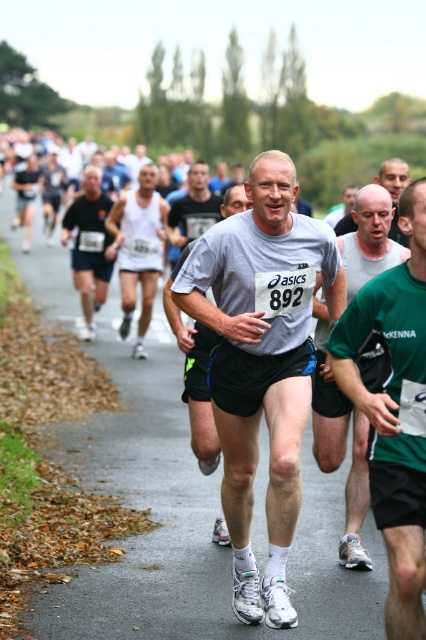
Question: Is white fabric runner at center positioned in front of smooth gray shirt at center?

Choices:
 (A) no
 (B) yes

Answer: (B)

Question: Which object appears farthest from the camera in this image?

Choices:
 (A) green fabric shirt at center
 (B) matte gray t-shirt at center

Answer: (A)

Question: Which object appears closest to the camera in this image?

Choices:
 (A) matte black shorts at left
 (B) white fabric runner at center
 (C) smooth gray shirt at center
 (D) green fabric shirt at center

Answer: (B)

Question: Is white fabric runner at center thinner than white matte tank top at center?

Choices:
 (A) yes
 (B) no

Answer: (B)

Question: Which of the following is the farthest from the observer?

Choices:
 (A) (120, 241)
 (B) (279, 244)

Answer: (A)

Question: Is white fabric runner at center smaller than white matte tank top at center?

Choices:
 (A) no
 (B) yes

Answer: (A)